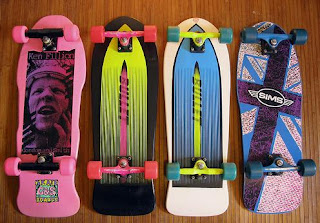
The height and width of the screenshot is (223, 320). Identify the location of black board. (150, 109).